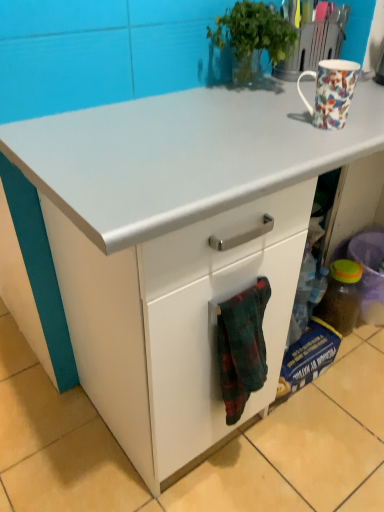
Question: In terms of height, does green leafy plant at upper center look taller or shorter compared to flannel fabric towel at lower center?

Choices:
 (A) tall
 (B) short

Answer: (B)

Question: In terms of size, does green leafy plant at upper center appear bigger or smaller than flannel fabric towel at lower center?

Choices:
 (A) big
 (B) small

Answer: (A)

Question: Estimate the real-world distances between objects in this image. Which object is farther from the flannel fabric towel at lower center?

Choices:
 (A) floral porcelain mug at upper right
 (B) translucent plastic bottle at lower right
 (C) green leafy plant at upper center

Answer: (B)

Question: Based on their relative distances, which object is nearer to the green leafy plant at upper center?

Choices:
 (A) translucent plastic bottle at lower right
 (B) flannel fabric towel at lower center
 (C) floral porcelain mug at upper right

Answer: (C)